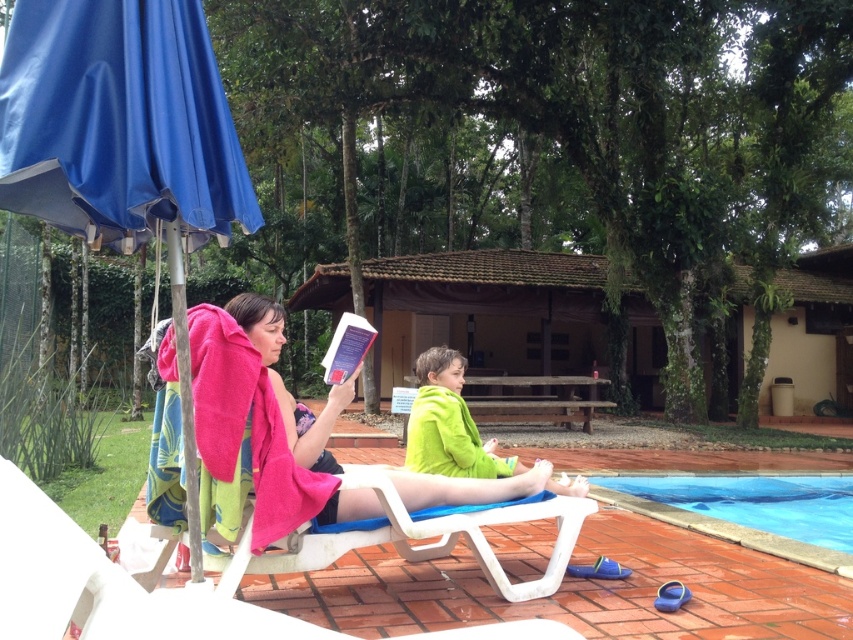
You are planning to place a new decorative plant pot between the blue fabric umbrella at upper left and the green fleece jacket at lower center. Based on their positions, which object should the plant pot be nearer to?

The plant pot should be nearer to the green fleece jacket at lower center because the blue fabric umbrella at upper left is closer to the viewer, meaning the green fleece jacket is further away, so placing the pot between them would require it to be closer to the jacket to maintain proper spacing.

You are a photographer standing at the camera position. You want to capture a closeup shot of the blue fabric umbrella at upper left. Can you reach it without moving your position? Please explain.

The blue fabric umbrella at upper left is 5.54 feet away from camera. Since the photographer is at the camera position, they can extend their arm or use a zoom lens to reach the umbrella within that distance for a closeup shot.

You are planning to set up a parasol for shade at the poolside. The blue fabric umbrella at upper left and the pink towel at center are both in your way. Which object should you move first to make space for the parasol?

The blue fabric umbrella at upper left has a lesser width compared to pink towel at center, so you should move the pink towel at center first because it occupies more space.